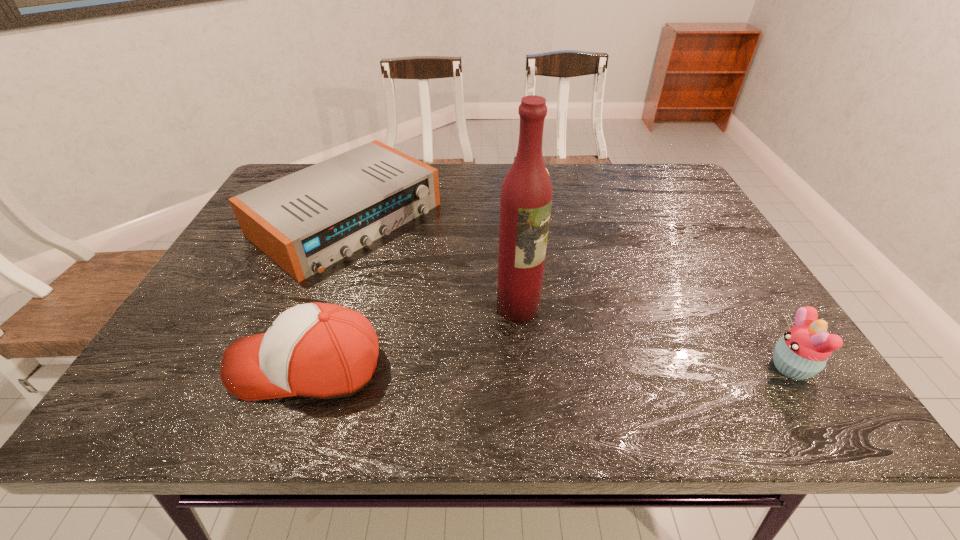
I want to click on free space that is in between the third farthest object and the shortest object, so click(x=432, y=263).

Identify the location of object that is the nearest to the duck. This screenshot has width=960, height=540. (306, 221).

Choose which object is the third nearest neighbor to the tallest object. Please provide its 2D coordinates. Your answer should be formatted as a tuple, i.e. [(x, y)], where the tuple contains the x and y coordinates of a point satisfying the conditions above.

[(545, 167)]

You are a GUI agent. You are given a task and a screenshot of the screen. Output one action in this format:
    pyautogui.click(x=<x>, y=<y>)
    Task: Click on the vacant position in the image that satisfies the following two spatial constraints: 1. on the front side of the radio receiver; 2. on the front-facing side of the baseball cap
    The height and width of the screenshot is (540, 960).
    Given the screenshot: What is the action you would take?
    pyautogui.click(x=288, y=366)